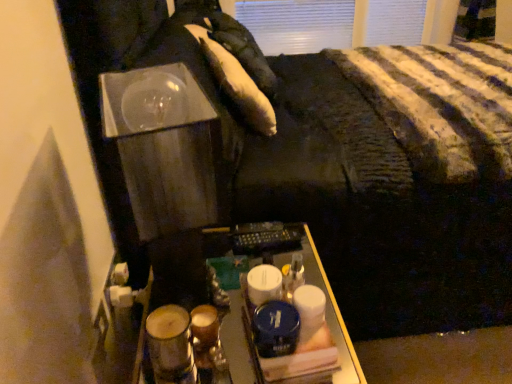
Question: Considering the positions of white soft pillow at upper center, acting as the 2th pillow starting from the bottom, and matte brown glass at lower left in the image, is white soft pillow at upper center, acting as the 2th pillow starting from the bottom, wider or thinner than matte brown glass at lower left?

Choices:
 (A) thin
 (B) wide

Answer: (B)

Question: From the image's perspective, is white soft pillow at upper center, which appears as the first pillow when viewed from the back, above or below matte brown glass at lower left?

Choices:
 (A) below
 (B) above

Answer: (B)

Question: Which object is the farthest from the matte brown glass at lower left?

Choices:
 (A) white soft pillow at upper center, which appears as the first pillow when viewed from the back
 (B) metallic remote control at center
 (C) white soft pillow at upper center, arranged as the 2th pillow when viewed from the back

Answer: (A)

Question: Which of these objects is positioned closest to the metallic remote control at center?

Choices:
 (A) white soft pillow at upper center, the 1th pillow from the top
 (B) white soft pillow at upper center, which ranks as the 1th pillow in front-to-back order
 (C) matte brown glass at lower left

Answer: (C)